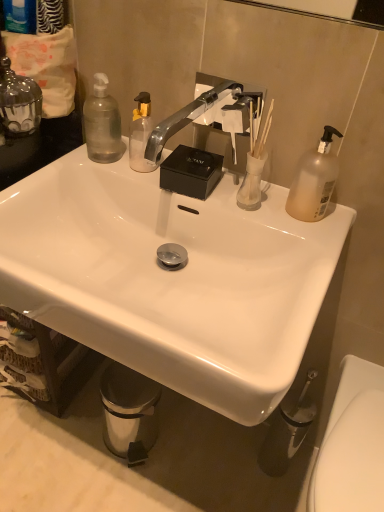
Question: Is metallic silver trash can at lower left spatially inside clear glass candle at upper left, positioned as the 3th bottle in right-to-left order, or outside of it?

Choices:
 (A) inside
 (B) outside

Answer: (B)

Question: Considering their positions, is metallic silver trash can at lower left located in front of or behind clear glass candle at upper left, the first bottle from the left?

Choices:
 (A) behind
 (B) front

Answer: (A)

Question: Which of these objects is positioned farthest from the silver metallic faucet at center?

Choices:
 (A) white glossy toilet at lower right
 (B) translucent glass vase at upper right
 (C) metallic silver trash can at lower left
 (D) white glossy sink at center
 (E) transparent plastic bottle at upper left, acting as the 2th bottle starting from the right

Answer: (C)

Question: Based on their relative distances, which object is farther from the white glossy toilet at lower right?

Choices:
 (A) white glossy sink at center
 (B) metallic silver trash can at lower left
 (C) clear glass candle at upper left, the first bottle from the left
 (D) transparent plastic bottle at upper left, acting as the 2th bottle starting from the right
 (E) silver metallic faucet at center

Answer: (C)